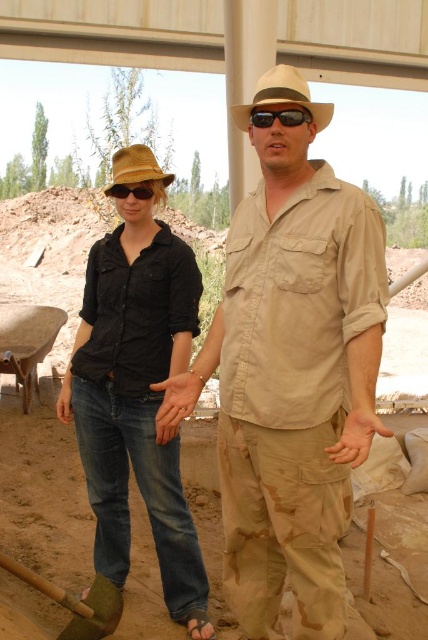
Question: Which of the following is the closest to the observer?

Choices:
 (A) matte black shirt at center
 (B) black matte sunglasses at center
 (C) natural straw cowboy hat at center

Answer: (A)

Question: Which point is farther to the camera?

Choices:
 (A) (299, 118)
 (B) (204, 566)
 (C) (0, 561)
 (D) (294, 406)

Answer: (B)

Question: Which of the following is the farthest from the observer?

Choices:
 (A) (139, 160)
 (B) (14, 563)
 (C) (288, 124)
 (D) (118, 451)

Answer: (D)

Question: Does beige straw cowboy hat at center appear over black matte sunglasses at center?

Choices:
 (A) yes
 (B) no

Answer: (A)

Question: Does beige straw cowboy hat at center have a greater width compared to natural straw cowboy hat at center?

Choices:
 (A) yes
 (B) no

Answer: (B)

Question: Is sunglasses at center closer to the viewer compared to black matte sunglasses at center?

Choices:
 (A) no
 (B) yes

Answer: (B)